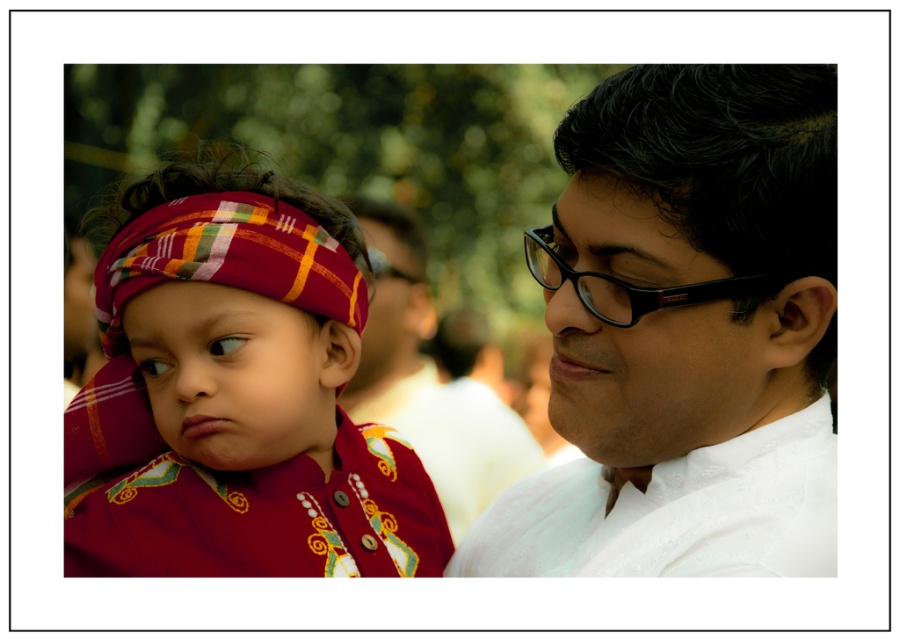
In the scene shown: Is white textured shirt at right wider than black plastic glasses at center?

Correct, the width of white textured shirt at right exceeds that of black plastic glasses at center.

Find the location of `white textured shirt at right`. white textured shirt at right is located at coordinates (685, 333).

At what (x,y) coordinates should I click in order to perform the action: click on white textured shirt at right. Please return your answer as a coordinate pair (x, y). Image resolution: width=900 pixels, height=640 pixels. Looking at the image, I should click on (685, 333).

Does matte fabric turban at left have a larger size compared to black plastic glasses at center?

Correct, matte fabric turban at left is larger in size than black plastic glasses at center.

This screenshot has width=900, height=640. I want to click on matte fabric turban at left, so click(x=236, y=394).

The width and height of the screenshot is (900, 640). Identify the location of matte fabric turban at left. (236, 394).

Can you confirm if matte fabric forehead at center is shorter than black plastic glasses at right?

Indeed, matte fabric forehead at center has a lesser height compared to black plastic glasses at right.

Can you confirm if matte fabric forehead at center is positioned to the right of black plastic glasses at right?

No, matte fabric forehead at center is not to the right of black plastic glasses at right.

Who is more forward, (204, 326) or (666, 307)?

Point (666, 307) is in front.

At what (x,y) coordinates should I click in order to perform the action: click on matte fabric forehead at center. Please return your answer as a coordinate pair (x, y). Looking at the image, I should click on (200, 314).